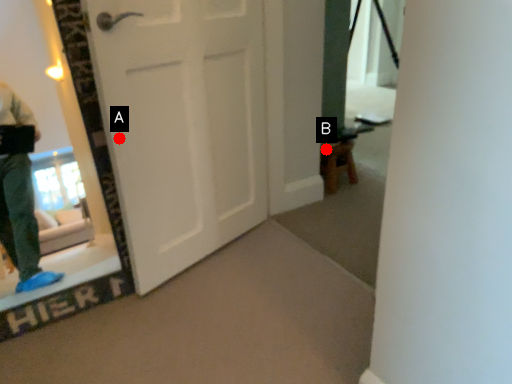
Question: Two points are circled on the image, labeled by A and B beside each circle. Which point appears closest to the camera in this image?

Choices:
 (A) A is closer
 (B) B is closer

Answer: (A)